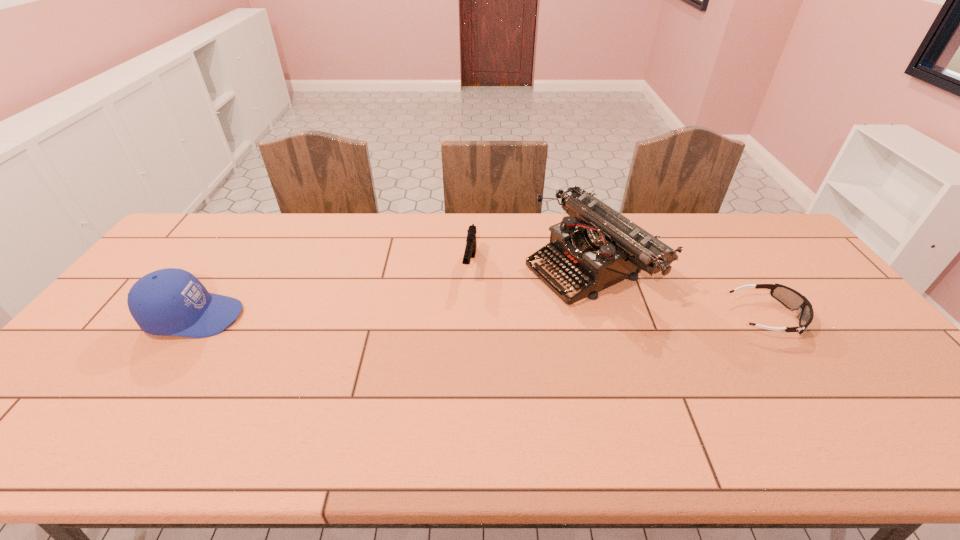
You are a GUI agent. You are given a task and a screenshot of the screen. Output one action in this format:
    pyautogui.click(x=<x>, y=<y>)
    Task: Click on the cap
    This screenshot has width=960, height=540.
    Given the screenshot: What is the action you would take?
    pyautogui.click(x=171, y=301)

This screenshot has width=960, height=540. I want to click on the leftmost object, so click(x=171, y=301).

Locate an element on the screen. goggles is located at coordinates (790, 298).

The image size is (960, 540). I want to click on the rightmost object, so click(x=790, y=298).

Find the location of a particular element. Image resolution: width=960 pixels, height=540 pixels. the tallest object is located at coordinates (598, 247).

Locate an element on the screen. Image resolution: width=960 pixels, height=540 pixels. typewriter is located at coordinates (598, 247).

Where is `the second shortest object`? The width and height of the screenshot is (960, 540). the second shortest object is located at coordinates (470, 250).

At what (x,y) coordinates should I click in order to perform the action: click on the second object from left to right. Please return your answer as a coordinate pair (x, y). Image resolution: width=960 pixels, height=540 pixels. Looking at the image, I should click on (470, 250).

This screenshot has width=960, height=540. I want to click on vacant space located on the front-facing side of the second tallest object, so click(352, 317).

At what (x,y) coordinates should I click in order to perform the action: click on blank space located on the front and sides of the shortest object. Please return your answer as a coordinate pair (x, y). Looking at the image, I should click on (828, 316).